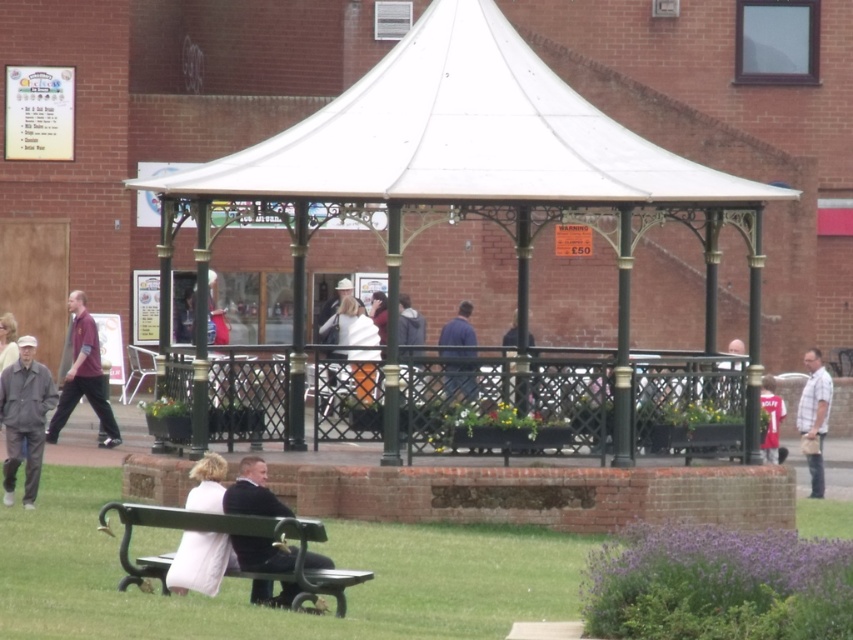
Which is above, white fabric canopy at center or matte red jersey at right?

white fabric canopy at center

Is white fabric canopy at center to the right of matte red jersey at right from the viewer's perspective?

Incorrect, white fabric canopy at center is not on the right side of matte red jersey at right.

Identify the location of white fabric canopy at center. (462, 134).

Does white metal gazebo at center have a greater width compared to matte red jersey at right?

Yes, white metal gazebo at center is wider than matte red jersey at right.

This screenshot has height=640, width=853. I want to click on white metal gazebo at center, so click(x=473, y=186).

This screenshot has height=640, width=853. What do you see at coordinates (473, 186) in the screenshot?
I see `white metal gazebo at center` at bounding box center [473, 186].

Where is `white metal gazebo at center`? white metal gazebo at center is located at coordinates (473, 186).

Does white metal gazebo at center appear over dark suit at center?

Indeed, white metal gazebo at center is positioned over dark suit at center.

Is point (640, 216) closer to viewer compared to point (267, 580)?

No.

You are a GUI agent. You are given a task and a screenshot of the screen. Output one action in this format:
    pyautogui.click(x=<x>, y=<y>)
    Task: Click on the white metal gazebo at center
    Image resolution: width=853 pixels, height=640 pixels.
    Given the screenshot: What is the action you would take?
    pyautogui.click(x=473, y=186)